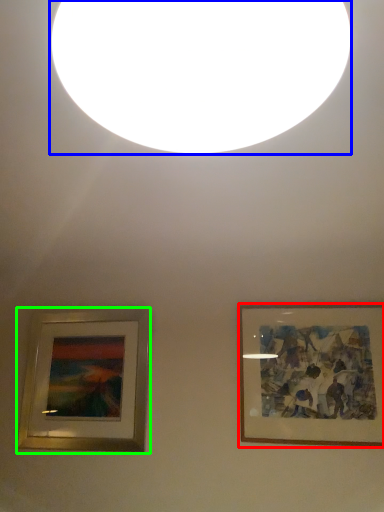
Question: Considering the real-world distances, which object is farthest from picture frame (highlighted by a red box)? lighting (highlighted by a blue box) or picture frame (highlighted by a green box)?

Choices:
 (A) lighting
 (B) picture frame

Answer: (A)